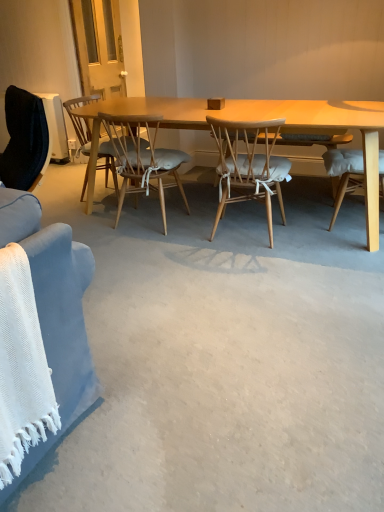
Find the location of a particular element. The width and height of the screenshot is (384, 512). vacant area that lies between light brown woven wood chair at center, the first chair positioned from the right, and light brown wood chair at center, the second chair in the right-to-left sequence is located at coordinates (192, 227).